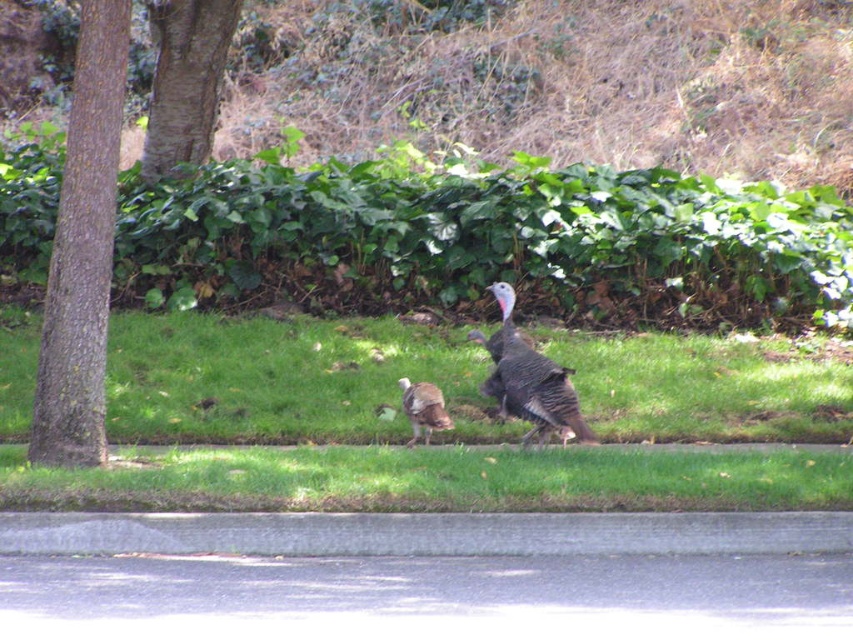
Can you confirm if brown rough bark tree at left is positioned above brown feathered turkey at center?

Yes, brown rough bark tree at left is above brown feathered turkey at center.

Can you confirm if brown rough bark tree at left is shorter than brown feathered turkey at center?

No.

Is point (48, 273) farther from viewer compared to point (421, 385)?

Yes, it is behind point (421, 385).

This screenshot has width=853, height=640. I want to click on brown rough bark tree at left, so click(82, 250).

You are a GUI agent. You are given a task and a screenshot of the screen. Output one action in this format:
    pyautogui.click(x=<x>, y=<y>)
    Task: Click on the brown rough bark tree at left
    This screenshot has height=640, width=853.
    Given the screenshot: What is the action you would take?
    pyautogui.click(x=82, y=250)

Between brown rough bark tree at left and brown rough bark tree at upper left, which one has more height?

Standing taller between the two is brown rough bark tree at left.

Locate an element on the screen. This screenshot has width=853, height=640. brown rough bark tree at left is located at coordinates (82, 250).

Can you confirm if gray concrete curb at lower center is taller than brown rough bark tree at left?

In fact, gray concrete curb at lower center may be shorter than brown rough bark tree at left.

Can you confirm if gray concrete curb at lower center is smaller than brown rough bark tree at left?

Correct, gray concrete curb at lower center occupies less space than brown rough bark tree at left.

Which is in front, point (526, 524) or point (33, 403)?

Point (526, 524) is more forward.

I want to click on gray concrete curb at lower center, so click(424, 532).